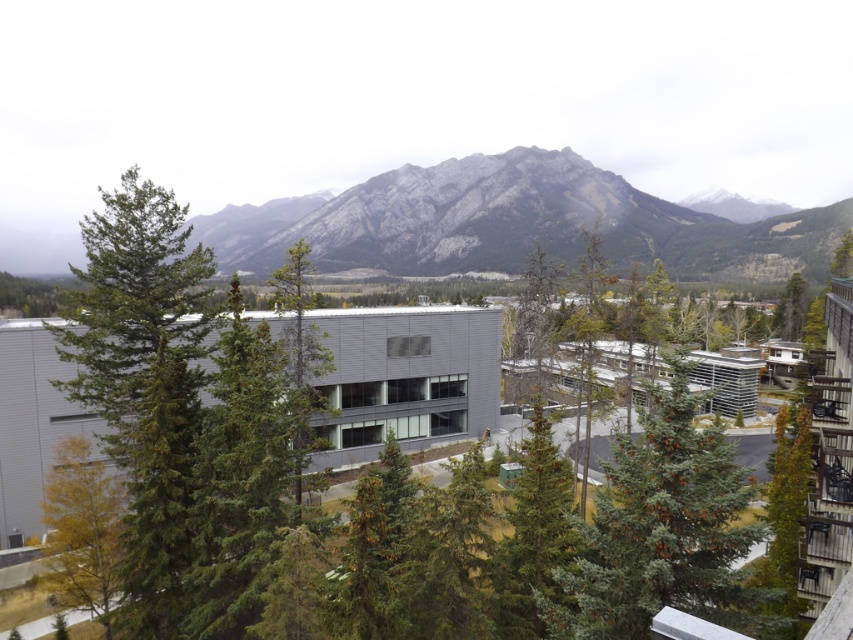
You are standing in front of the modern building and want to walk towards the green matte tree at upper right. Which direction should you move relative to the green matte tree at center?

You should move towards the upper right direction away from the green matte tree at center since the green matte tree at upper right is further away from you than the green matte tree at center.